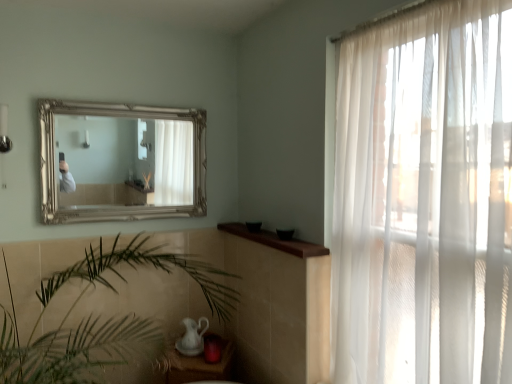
You are a GUI agent. You are given a task and a screenshot of the screen. Output one action in this format:
    pyautogui.click(x=<x>, y=<y>)
    Task: Click on the empty space that is ontop of gold metallic mirror at upper center (from a real-world perspective)
    
    Given the screenshot: What is the action you would take?
    (x=124, y=105)